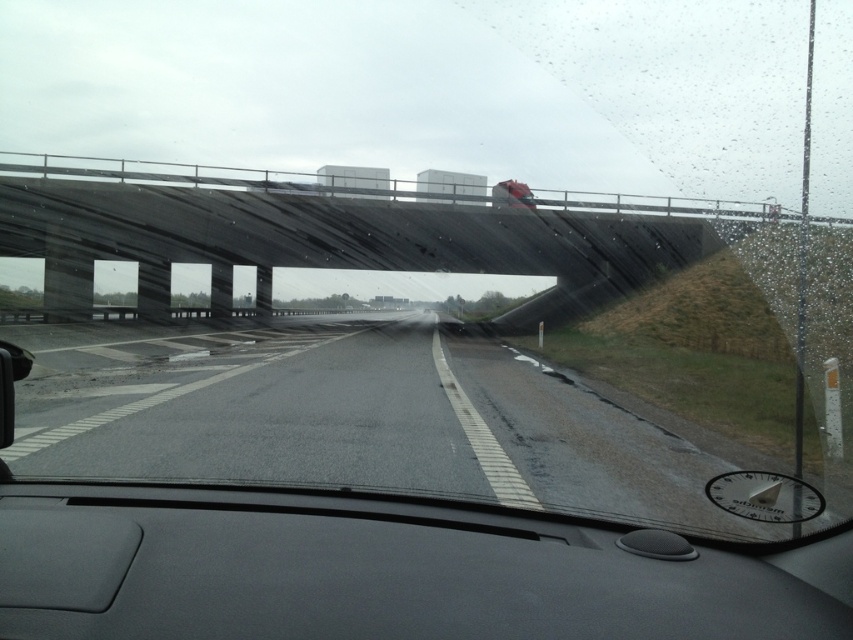
Measure the distance between point (378, 621) and camera.

A distance of 3.15 meters exists between point (378, 621) and camera.

How much distance is there between black matte dashboard at center and dark gray concrete bridge at upper center?

black matte dashboard at center is 49.33 meters from dark gray concrete bridge at upper center.

Which is behind, point (155, 516) or point (120, 179)?

The point (120, 179) is more distant.

At what (x,y) coordinates should I click in order to perform the action: click on black matte dashboard at center. Please return your answer as a coordinate pair (x, y). This screenshot has width=853, height=640. Looking at the image, I should click on (386, 570).

In the scene shown: Is black matte dashboard at center thinner than asphalt road at center?

Indeed, black matte dashboard at center has a lesser width compared to asphalt road at center.

This screenshot has width=853, height=640. I want to click on black matte dashboard at center, so click(386, 570).

Find the location of a particular element. black matte dashboard at center is located at coordinates (386, 570).

Does asphalt road at center appear over dark gray concrete bridge at upper center?

Actually, asphalt road at center is below dark gray concrete bridge at upper center.

The width and height of the screenshot is (853, 640). I want to click on asphalt road at center, so click(x=352, y=419).